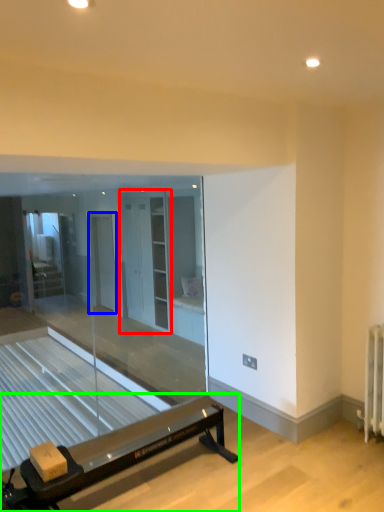
Question: Considering the real-world distances, which object is farthest from screen door (highlighted by a red box)? screen door (highlighted by a blue box) or furniture (highlighted by a green box)?

Choices:
 (A) screen door
 (B) furniture

Answer: (B)